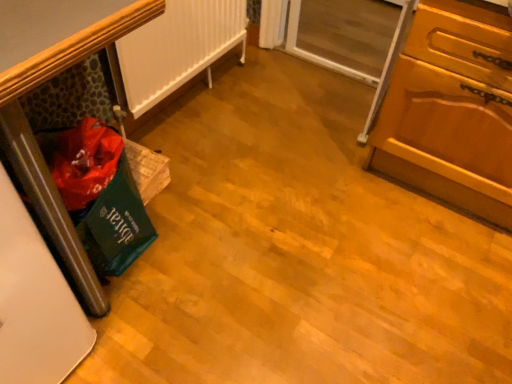
Where is `unoccupied region to the right of white matte radiator at left`? This screenshot has width=512, height=384. unoccupied region to the right of white matte radiator at left is located at coordinates (274, 121).